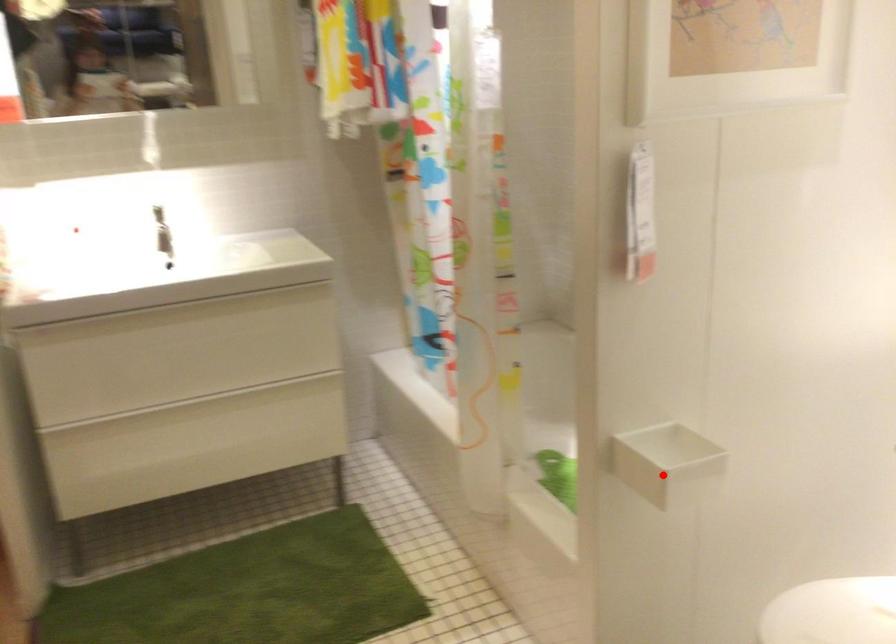
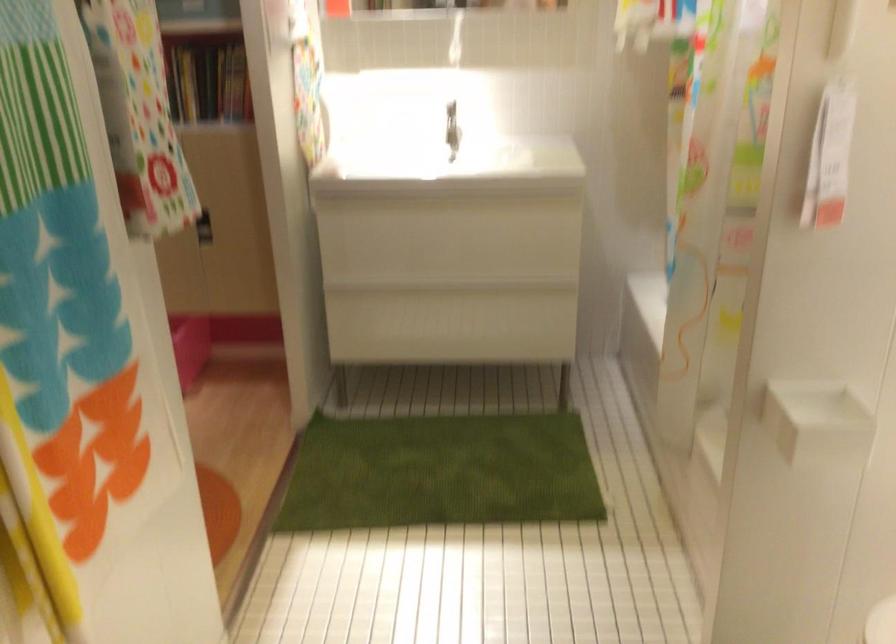
Where in the second image is the point corresponding to the highlighted location from the first image?

(816, 422)